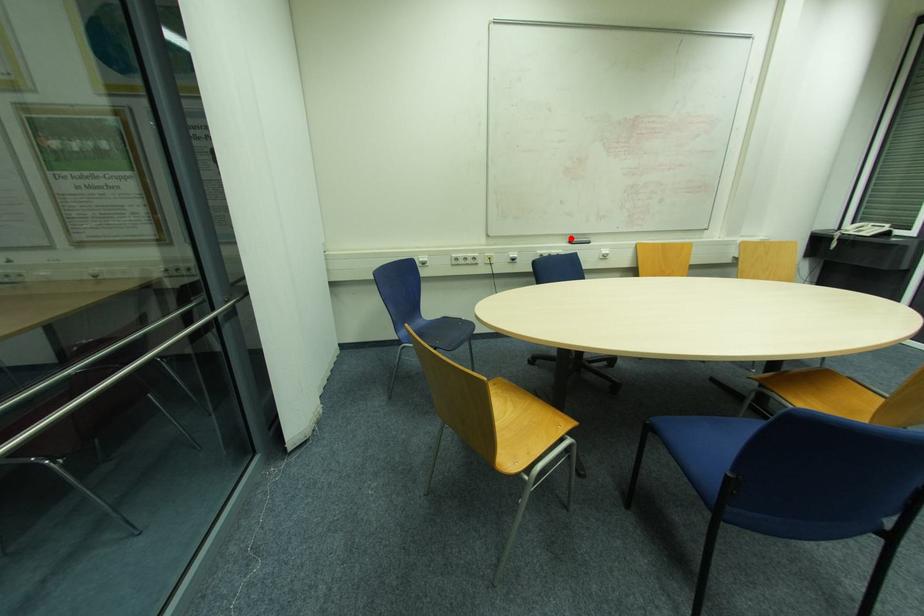
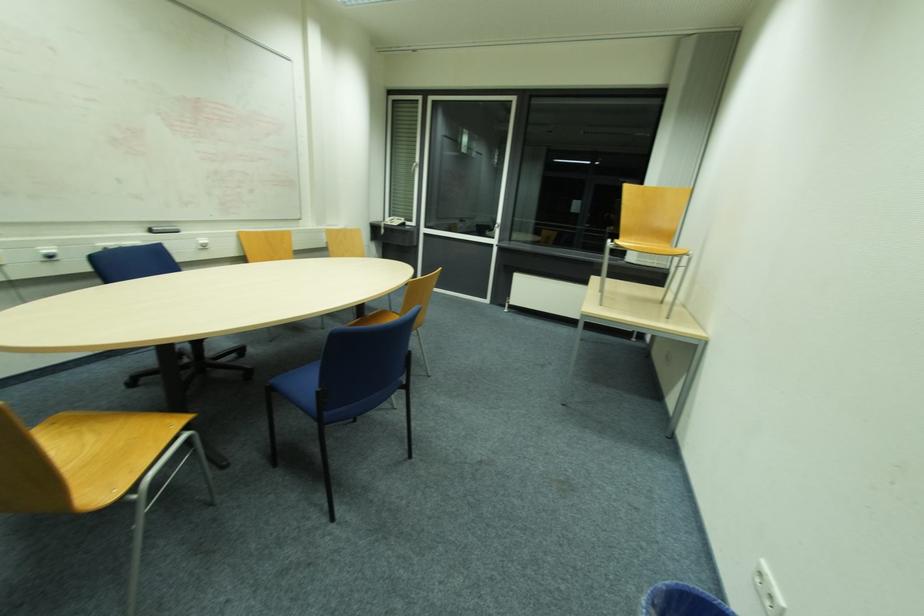
In the second image, find the point that corresponds to the highlighted location in the first image.

(151, 227)